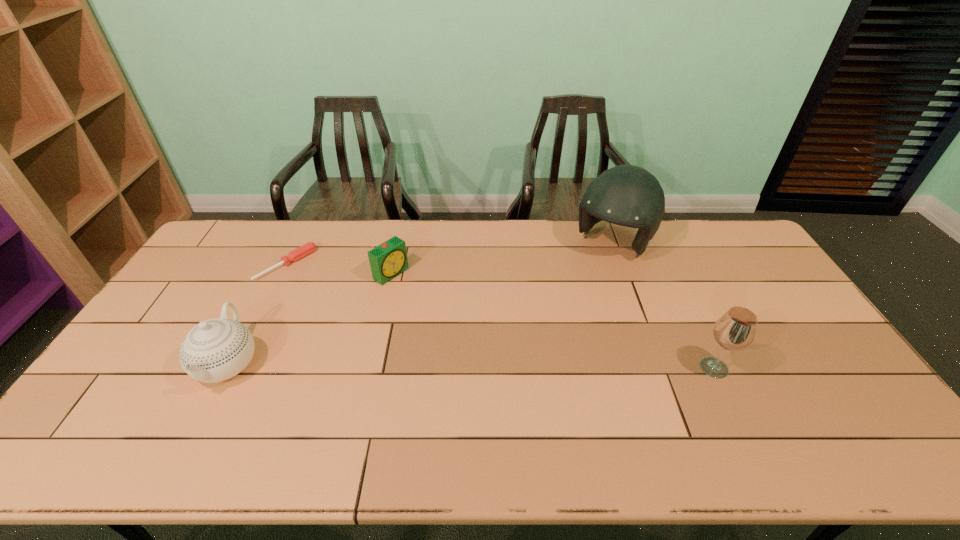
Locate an element on the screen. free location located at the tip of the shortest object is located at coordinates (331, 302).

Locate an element on the screen. free space located 0.390m at the tip of the shortest object is located at coordinates (374, 335).

Locate an element on the screen. This screenshot has width=960, height=540. vacant position located at the tip of the shortest object is located at coordinates click(x=353, y=319).

Identify the location of vacant space located at the face opening of the football helmet. The height and width of the screenshot is (540, 960). (588, 275).

Find the location of a particular element. This screenshot has height=540, width=960. free space located at the face opening of the football helmet is located at coordinates (577, 289).

The image size is (960, 540). I want to click on free space located at the face opening of the football helmet, so click(551, 322).

Where is `screwdriver situated at the far edge`? This screenshot has width=960, height=540. screwdriver situated at the far edge is located at coordinates (302, 251).

The height and width of the screenshot is (540, 960). Identify the location of football helmet at the far edge. (627, 195).

Where is `object situated at the near edge`? object situated at the near edge is located at coordinates (215, 350).

In the image, there is a desktop. At what (x,y) coordinates should I click in order to perform the action: click on vacant space at the far edge. Please return your answer as a coordinate pair (x, y). The image size is (960, 540). Looking at the image, I should click on (346, 219).